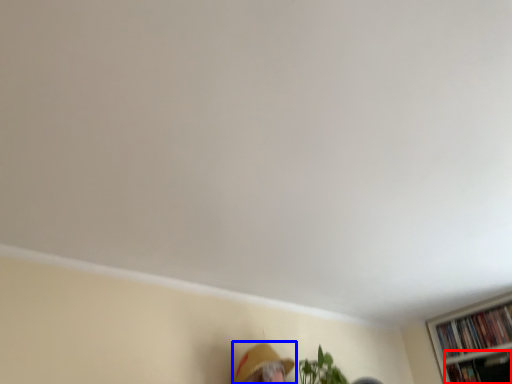
Question: Among these objects, which one is farthest to the camera, book (highlighted by a red box) or person (highlighted by a blue box)?

Choices:
 (A) book
 (B) person

Answer: (A)